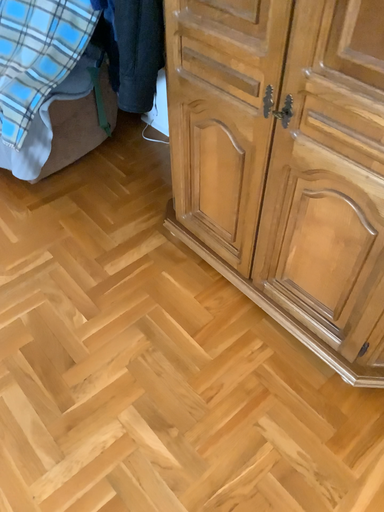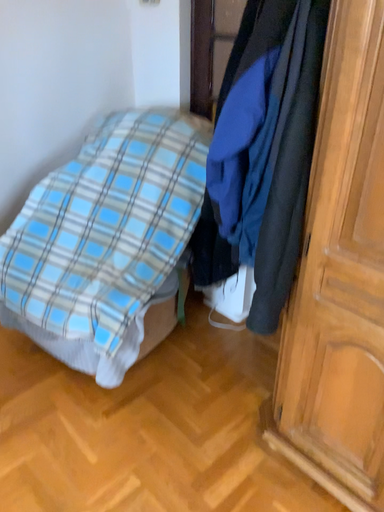
Question: Which way did the camera rotate in the video?

Choices:
 (A) rotated downward
 (B) rotated upward

Answer: (B)